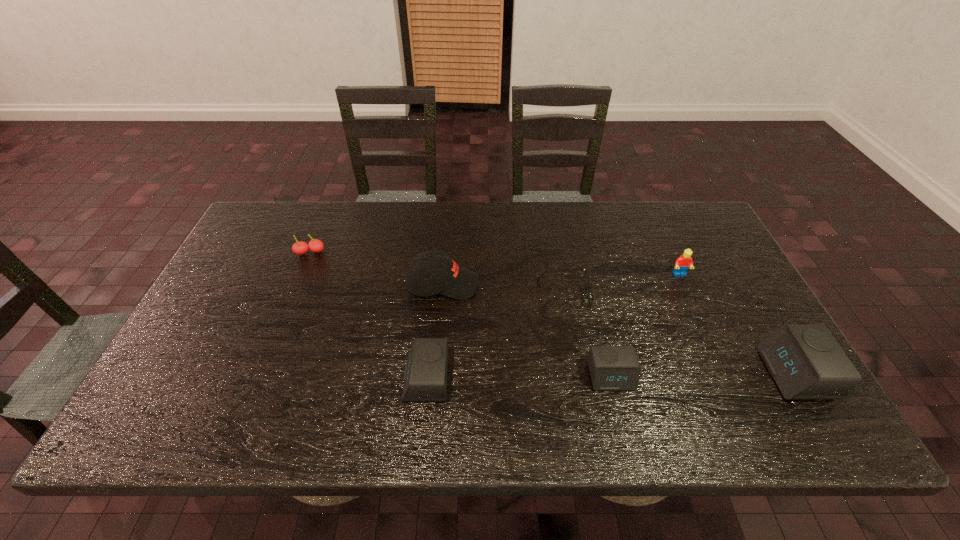
Observe the arrangement of all alarm clocks in the image. To keep them evenly spaced, where would you place another alarm clock on the left? Please locate a free space. Please provide its 2D coordinates. Your answer should be formatted as a tuple, i.e. [(x, y)], where the tuple contains the x and y coordinates of a point satisfying the conditions above.

[(238, 382)]